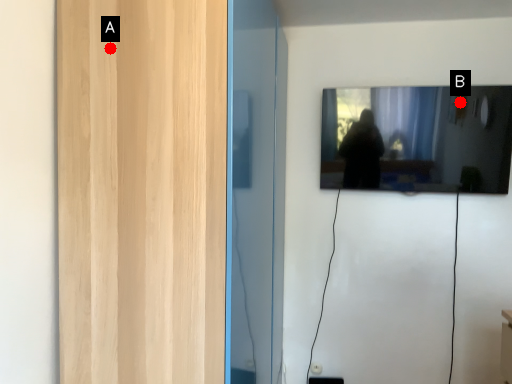
Question: Two points are circled on the image, labeled by A and B beside each circle. Which of the following is the farthest from the observer?

Choices:
 (A) A is further
 (B) B is further

Answer: (B)